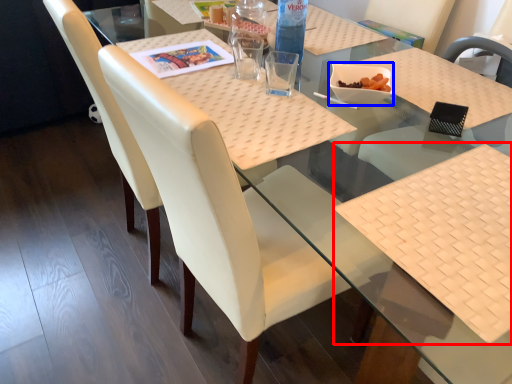
Question: Which point is closer to the camera, place mat (highlighted by a red box) or food (highlighted by a blue box)?

Choices:
 (A) place mat
 (B) food

Answer: (A)